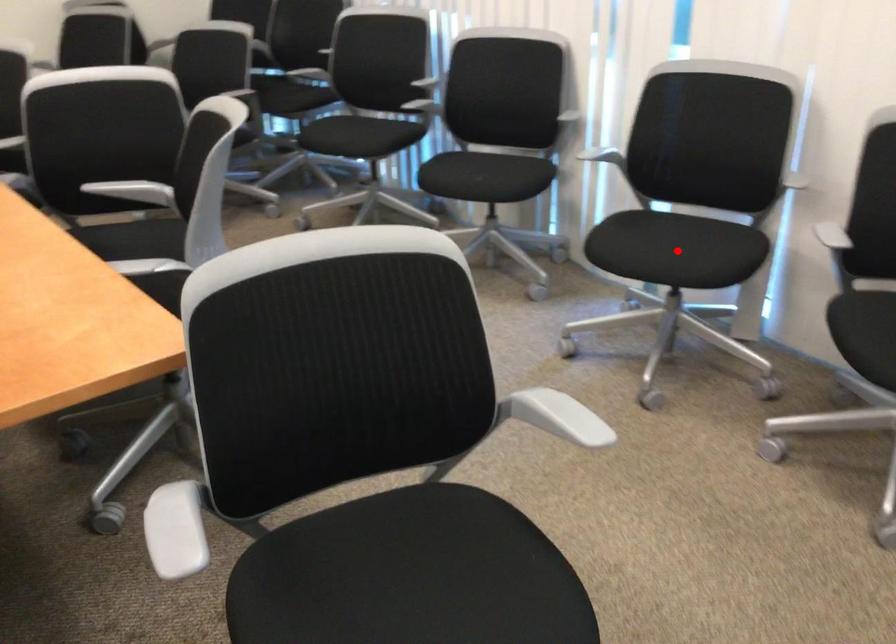
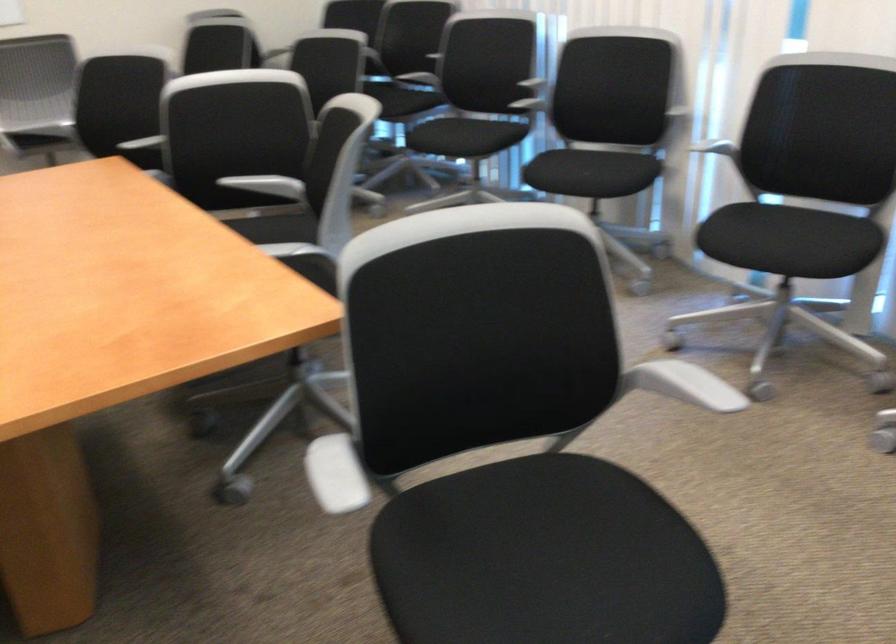
Question: I am providing you with two images of the same scene from different viewpoints. A red point is marked on the first image. At the location where the point appears in image 1, is it still visible in image 2?

Choices:
 (A) Yes
 (B) No

Answer: (A)